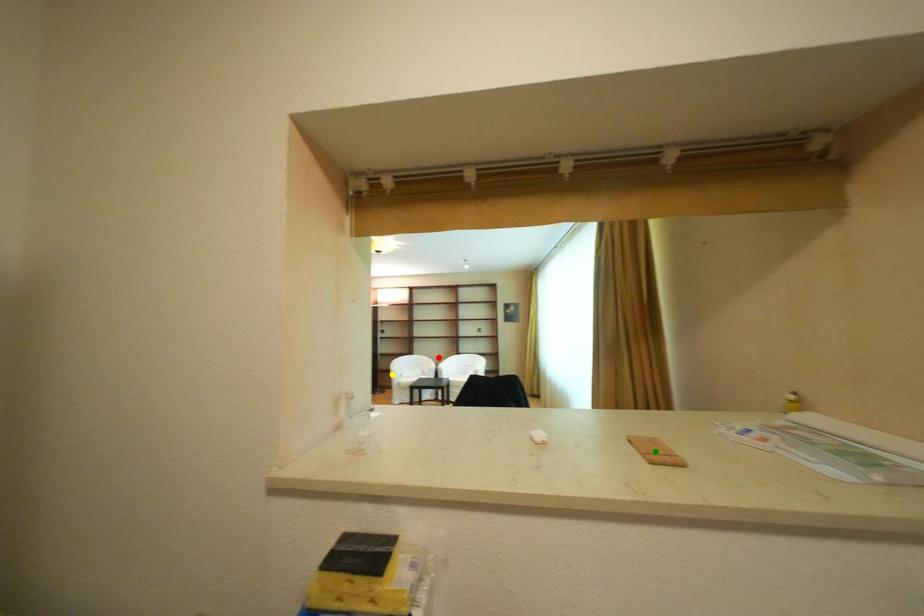
Order these from nearest to farthest:
red point | yellow point | green point

green point, yellow point, red point